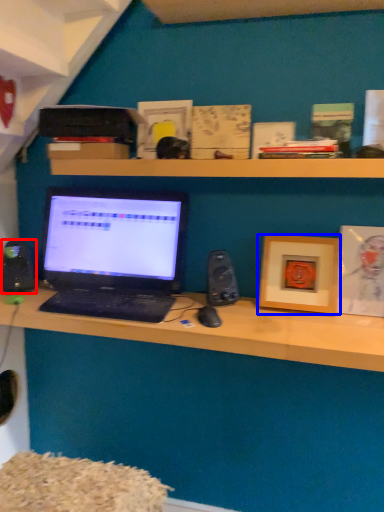
Question: Which point is closer to the camera, speaker (highlighted by a red box) or picture frame (highlighted by a blue box)?

Choices:
 (A) speaker
 (B) picture frame

Answer: (B)